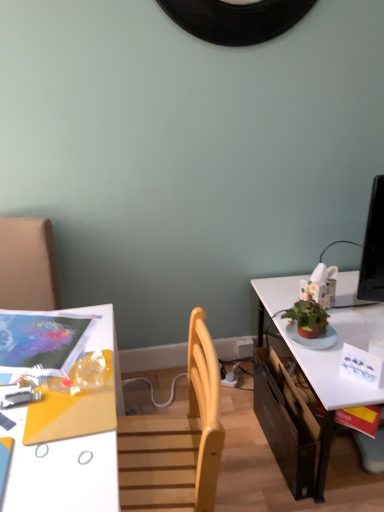
Locate an element on the screen. vacant space underneath matte plastic magazine at upper left (from a real-world perspective) is located at coordinates (36, 337).